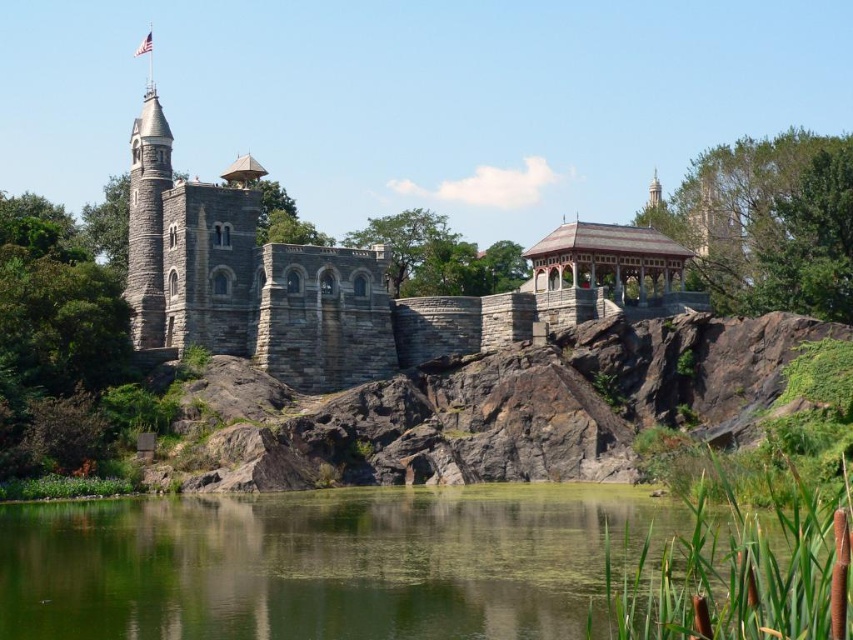
Question: Which point is farther from the camera taking this photo?

Choices:
 (A) (128, 248)
 (B) (589, 531)

Answer: (A)

Question: Which point is farther to the camera?

Choices:
 (A) (509, 604)
 (B) (161, 262)

Answer: (B)

Question: Can you confirm if green liquid water at lower center is positioned to the right of gray stone tower at upper left?

Choices:
 (A) no
 (B) yes

Answer: (B)

Question: Is green liquid water at lower center thinner than gray stone tower at upper left?

Choices:
 (A) no
 (B) yes

Answer: (A)

Question: Does green liquid water at lower center appear under gray stone tower at upper left?

Choices:
 (A) no
 (B) yes

Answer: (B)